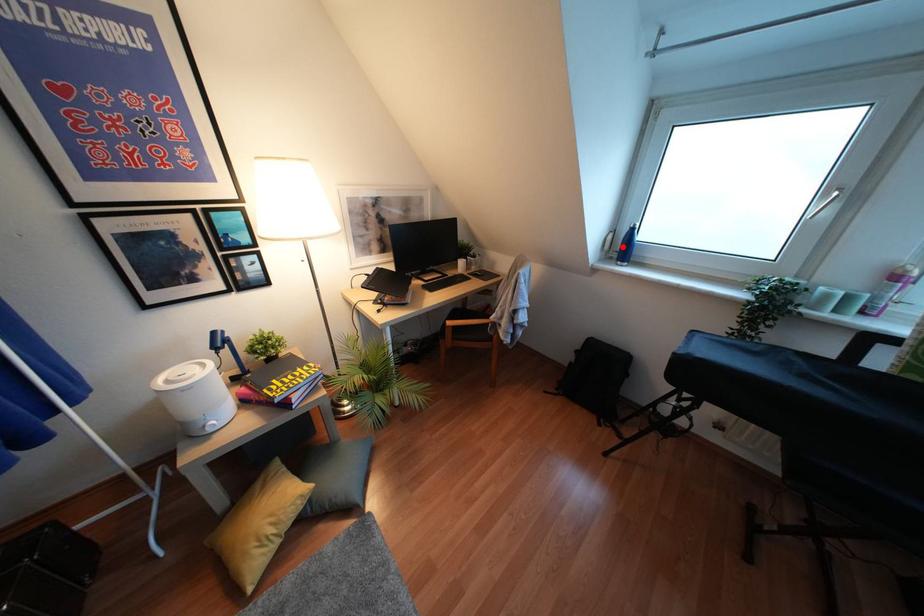
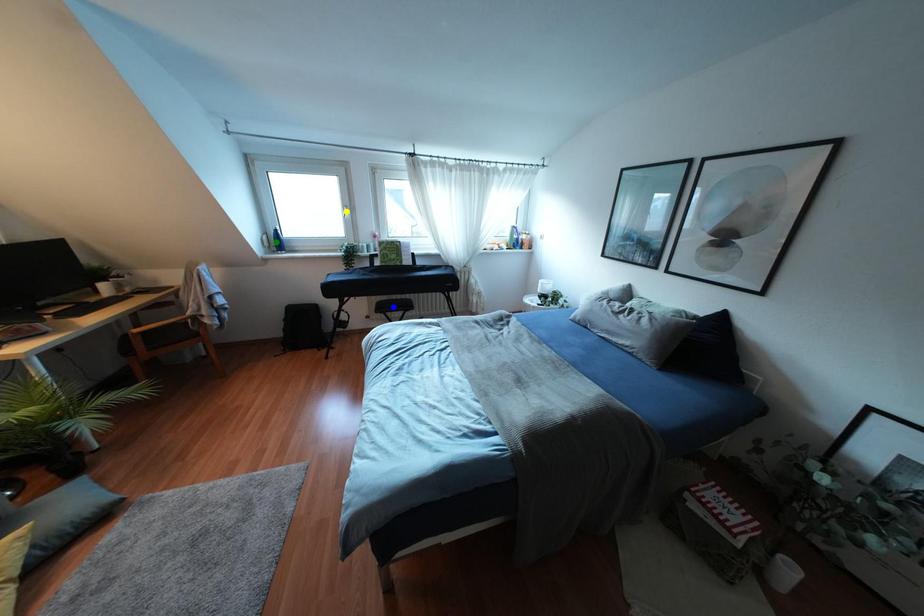
Question: I am providing you with two images of the same scene from different viewpoints. A red point is marked on the first image. You are given multiple points on the second image. Which point in image 2 represents the same 3d spot as the red point in image 1?

Choices:
 (A) blue point
 (B) green point
 (C) yellow point

Answer: (B)